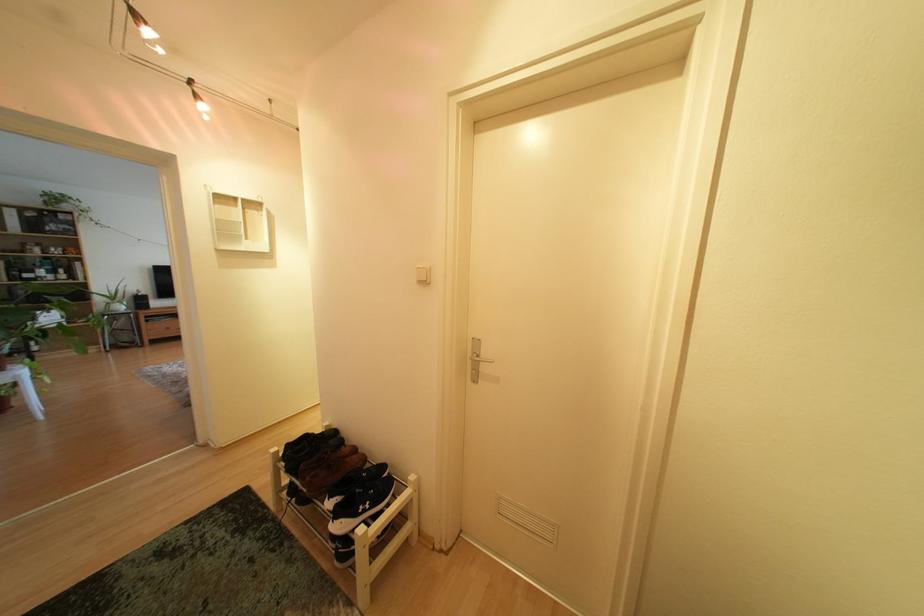
Where is `brown leather shoe`? The image size is (924, 616). brown leather shoe is located at coordinates (344, 483).